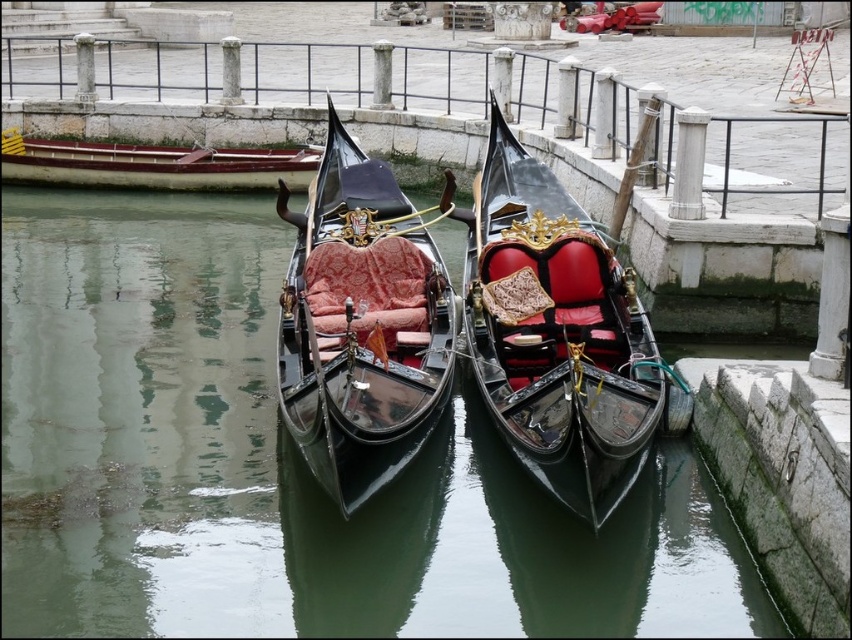
You are a tourist standing on the embankment next to the canal. You want to board the closest gondola to you. Which gondola should you choose between the shiny black gondola at center and the polished wood gondola at center?

The shiny black gondola at center is closer to the viewer, so you should choose the shiny black gondola at center to board.

You are standing on the stone embankment next to the canal and want to know where the glossy black water at center is positioned relative to the gondolas. Can you determine its exact coordinates?

The glossy black water at center is located at point (285,467) according to the coordinate system provided.